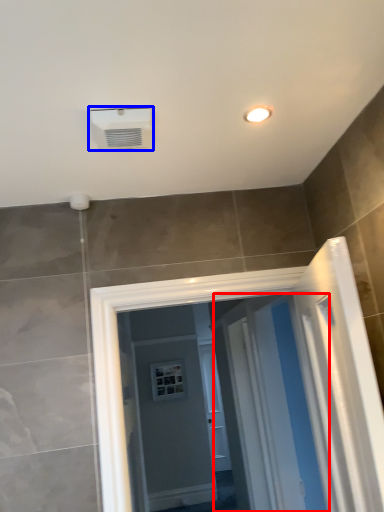
Question: Which object appears farthest to the camera in this image, screen door (highlighted by a red box) or air conditioning (highlighted by a blue box)?

Choices:
 (A) screen door
 (B) air conditioning

Answer: (A)